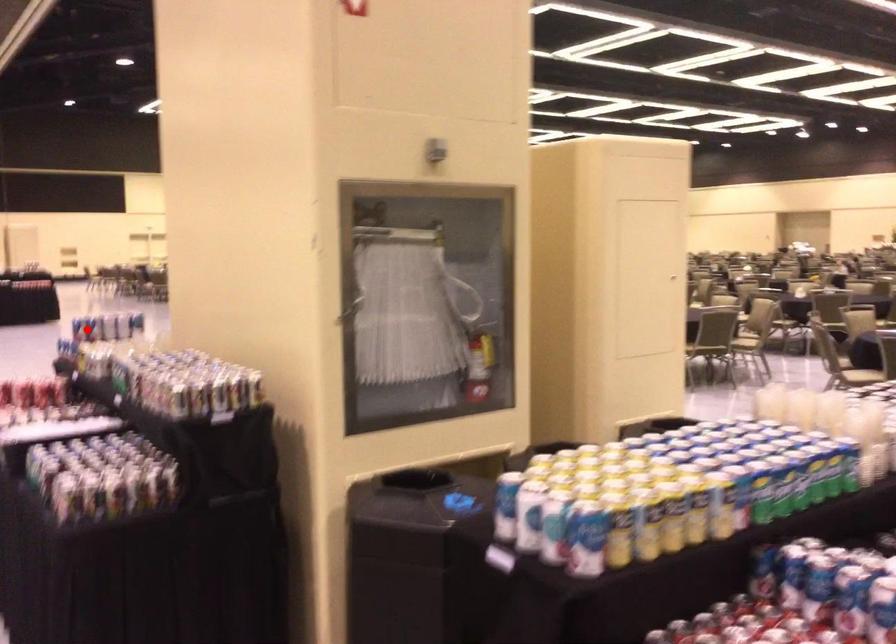
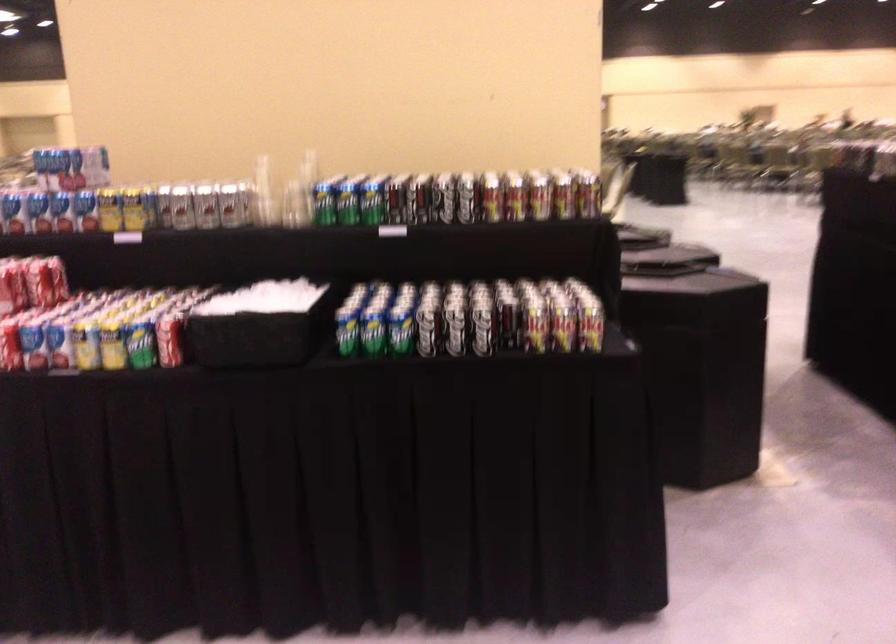
Locate, in the second image, the point that corresponds to the highlighted location in the first image.

(39, 211)